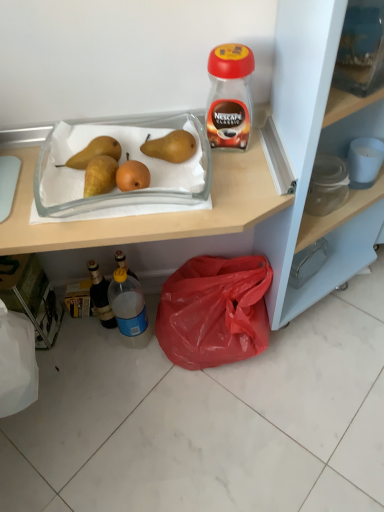
Find the location of a particular element. Image resolution: width=384 pixels, height=512 pixels. vacant area that lies between translucent plastic bottle at lower left, acting as the first bottle starting from the right, and red plastic bag at lower right is located at coordinates (148, 340).